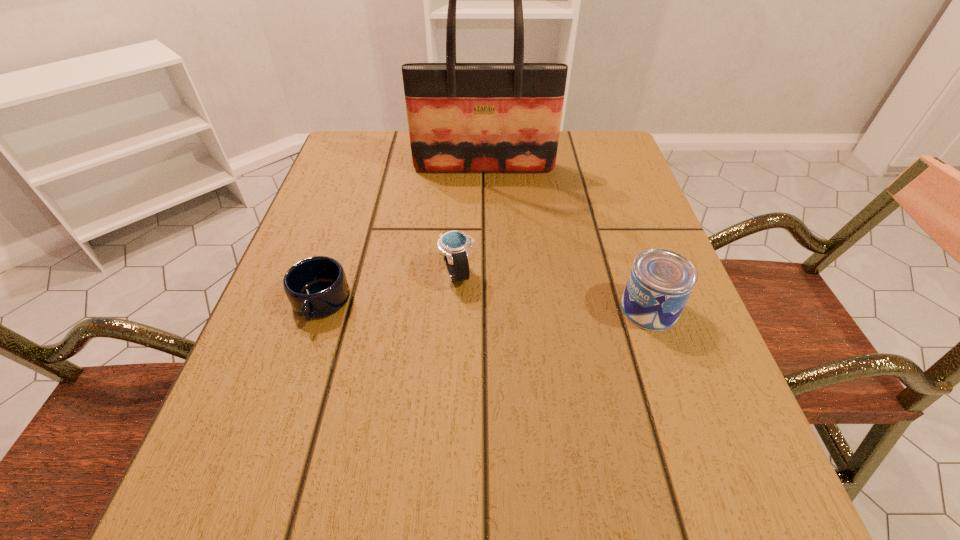
This screenshot has height=540, width=960. In order to click on the farthest object in this screenshot , I will do click(x=462, y=117).

I want to click on the tallest object, so click(462, 117).

The height and width of the screenshot is (540, 960). I want to click on can, so click(661, 281).

I want to click on watch, so click(455, 245).

Identify the location of the leftmost object. This screenshot has width=960, height=540. (316, 287).

Locate an element on the screen. The height and width of the screenshot is (540, 960). mug is located at coordinates (316, 287).

Locate an element on the screen. The height and width of the screenshot is (540, 960). free location located 0.220m on the front-facing side of the farthest object is located at coordinates (485, 239).

In order to click on vacant region located on the front label of the can in this screenshot , I will do click(x=569, y=308).

This screenshot has height=540, width=960. I want to click on vacant space located 0.280m on the front label of the can, so click(461, 308).

Identify the location of vacant area situated on the front label of the can. Image resolution: width=960 pixels, height=540 pixels. (501, 308).